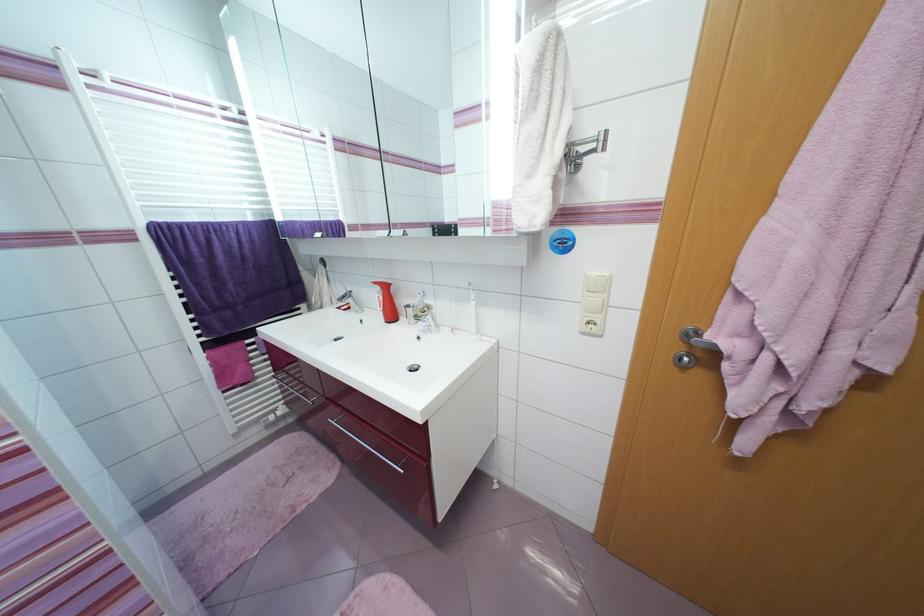
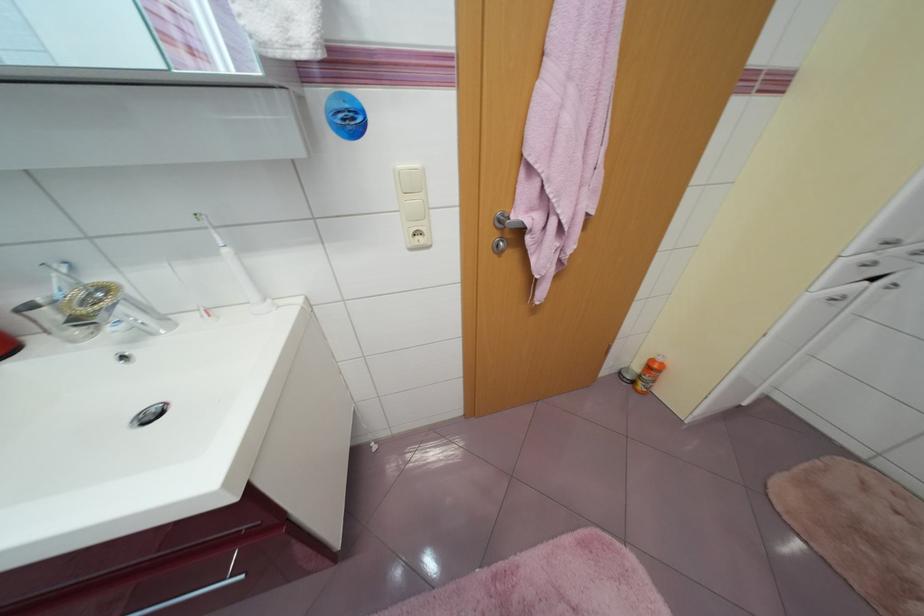
Locate, in the second image, the point that corresponds to (x=704, y=336) in the first image.

(513, 219)